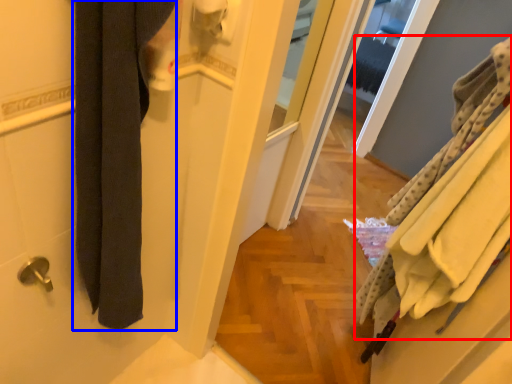
Question: Which of the following is the farthest to the observer, bath towel (highlighted by a red box) or bath towel (highlighted by a blue box)?

Choices:
 (A) bath towel
 (B) bath towel

Answer: (A)